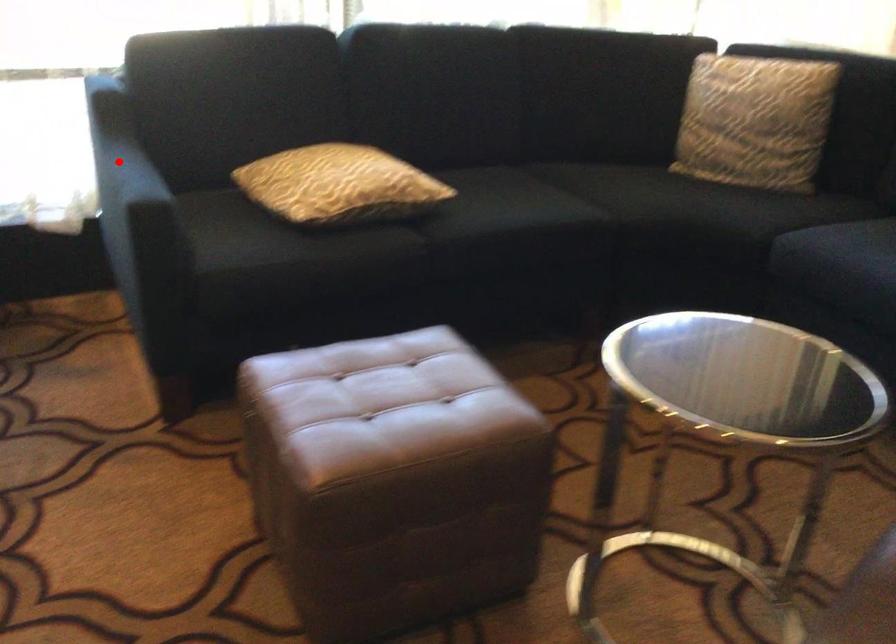
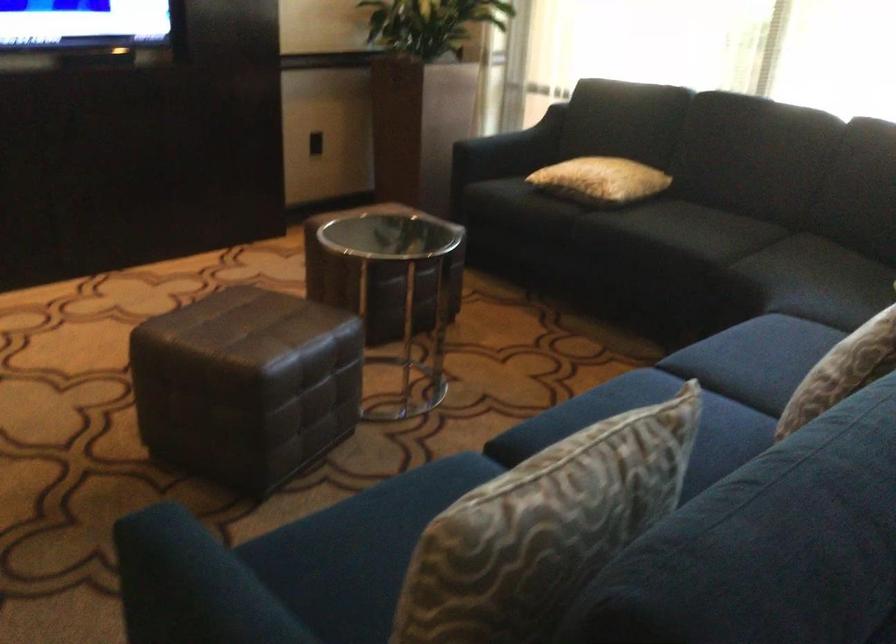
Question: I am providing you with two images of the same scene from different viewpoints. Given a red point in image1, look at the same physical point in image2. Is it:

Choices:
 (A) Closer to the viewpoint
 (B) Farther from the viewpoint

Answer: (B)